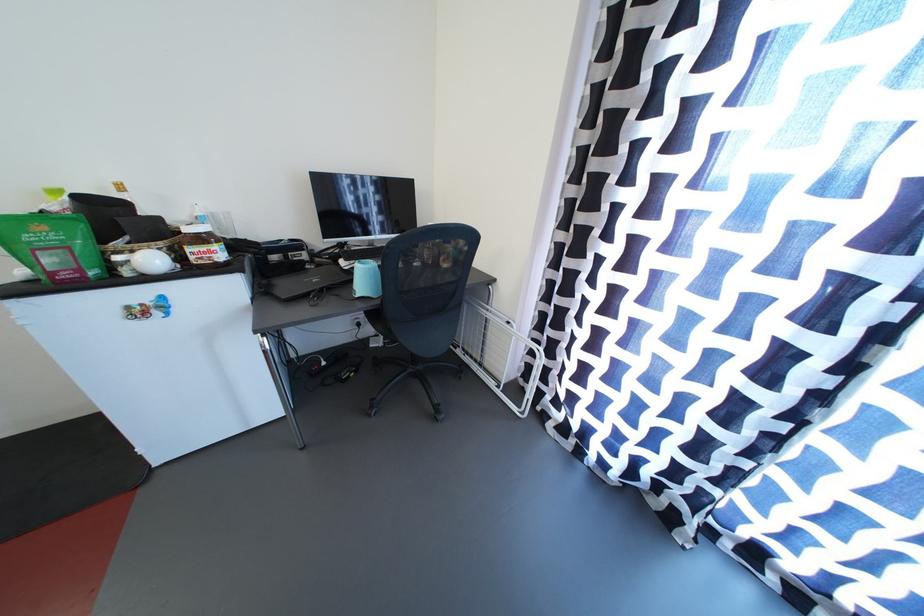
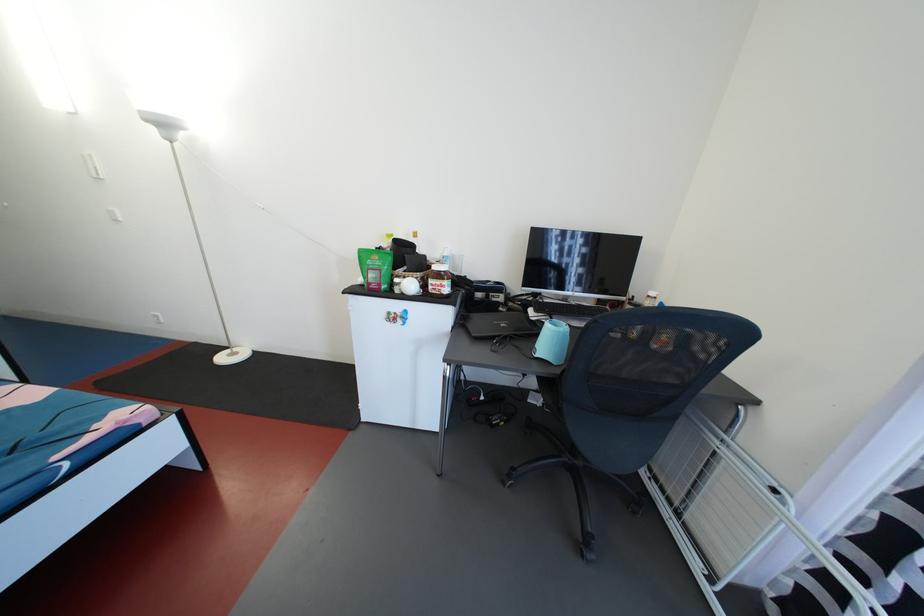
Question: Based on the continuous images, in which direction is the camera rotating? Reply with the corresponding letter.

Choices:
 (A) Left
 (B) Right
 (C) Up
 (D) Down

Answer: (A)